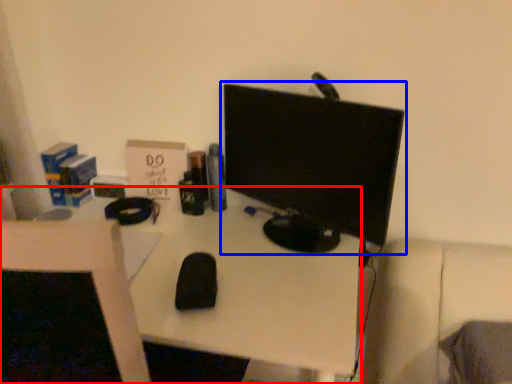
Question: Among these objects, which one is nearest to the camera, desk (highlighted by a red box) or computer monitor (highlighted by a blue box)?

Choices:
 (A) desk
 (B) computer monitor

Answer: (A)